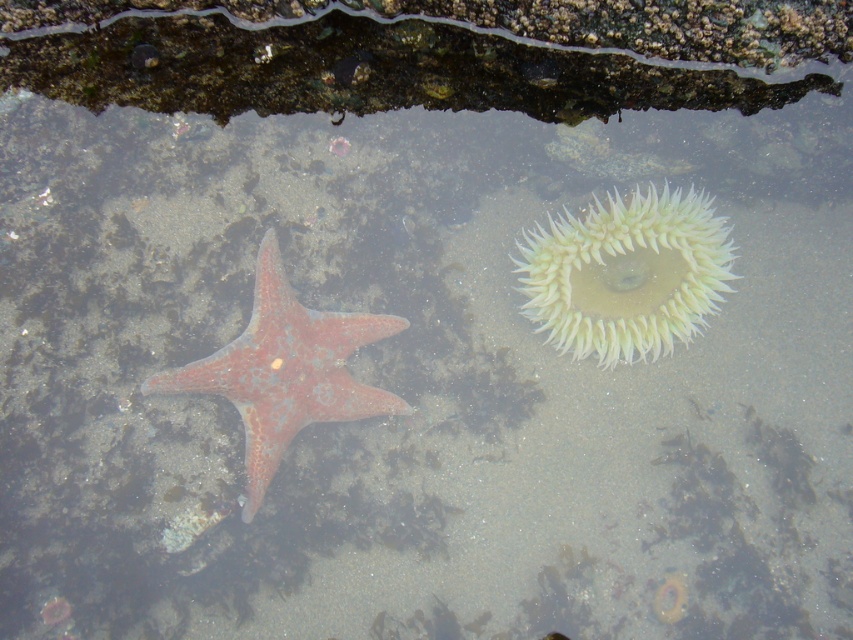
You are a marine biologist observing this tide pool from a boat anchored 10 feet away. You see the white spiky anemone at upper right. Can you reach it with a 3 foot long net without getting out of the boat?

The white spiky anemone at upper right is 8.97 feet away from the viewer. Since the boat is anchored 10 feet away, the net can reach 3 feet, so the total distance would be 10 feet minus 3 feet equals 7 feet. Since 7 feet is less than 8.97 feet, the net cannot reach the white spiky anemone at upper right.